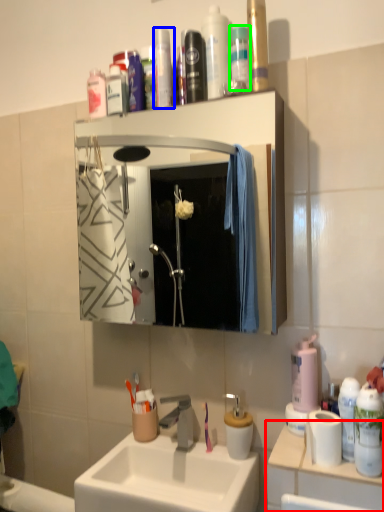
Question: Based on their relative distances, which object is nearer to counter top (highlighted by a red box)? Choose from toiletry (highlighted by a blue box) and mouthwash (highlighted by a green box).

Choices:
 (A) toiletry
 (B) mouthwash

Answer: (B)